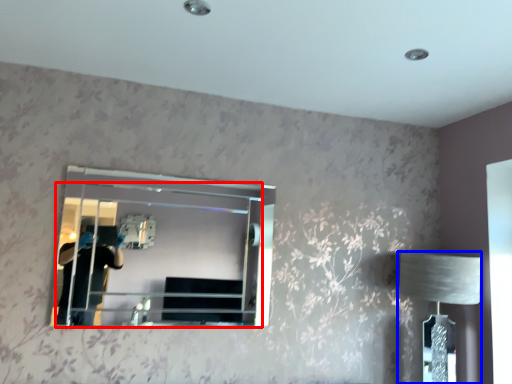
Question: Which point is closer to the camera, mirror (highlighted by a red box) or table lamp (highlighted by a blue box)?

Choices:
 (A) mirror
 (B) table lamp

Answer: (A)